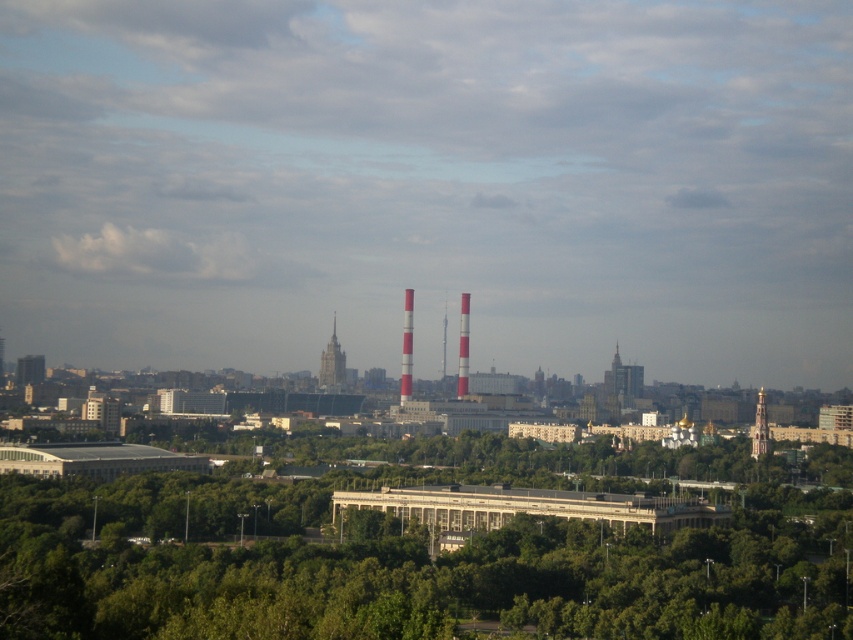
Question: Which of the following is the farthest from the observer?

Choices:
 (A) (407, 355)
 (B) (465, 387)
 (C) (759, 390)
 (D) (329, 385)

Answer: (C)

Question: Among these objects, which one is farthest from the camera?

Choices:
 (A) red and white striped tower at center
 (B) smooth glass skyscraper at center

Answer: (B)

Question: Which of these objects is positioned farthest from the gold textured dome at center?

Choices:
 (A) red and white striped tower at center
 (B) white striped tower at center
 (C) smooth glass skyscraper at center

Answer: (C)

Question: Can you confirm if smooth glass skyscraper at center is wider than gold textured tower at center-right?

Choices:
 (A) yes
 (B) no

Answer: (A)

Question: Does smooth glass skyscraper at center lie in front of red and white striped tower at center?

Choices:
 (A) no
 (B) yes

Answer: (A)

Question: Can you confirm if green leafy trees at center is smaller than gold textured tower at center-right?

Choices:
 (A) no
 (B) yes

Answer: (A)